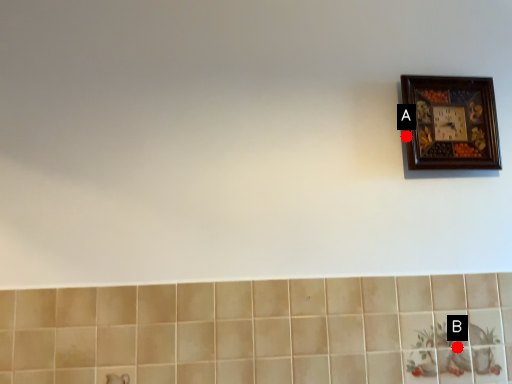
Question: Two points are circled on the image, labeled by A and B beside each circle. Among these points, which one is farthest from the camera?

Choices:
 (A) A is further
 (B) B is further

Answer: (A)